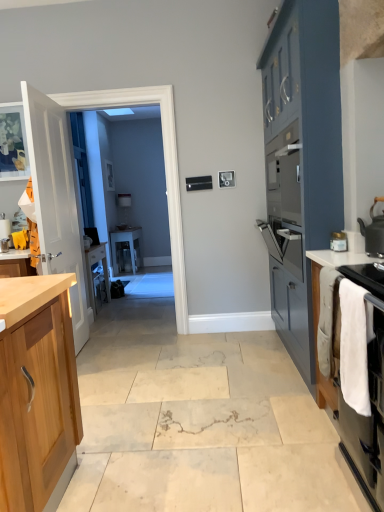
The height and width of the screenshot is (512, 384). Describe the element at coordinates (56, 198) in the screenshot. I see `white wood door at left` at that location.

Describe the element at coordinates (301, 159) in the screenshot. This screenshot has height=512, width=384. I see `matte blue cabinet at right` at that location.

Describe the element at coordinates (339, 258) in the screenshot. I see `white glossy countertop at right` at that location.

What is the approximate width of white fabric towel at right?

white fabric towel at right is 5.94 centimeters wide.

You are a GUI agent. You are given a task and a screenshot of the screen. Output one action in this format:
    pyautogui.click(x=<x>, y=<y>)
    Task: Click on the clear glass table at center
    Image resolution: width=384 pixels, height=512 pixels.
    Given the screenshot: What is the action you would take?
    pyautogui.click(x=126, y=250)

At what (x,y) coordinates should I click in order to perform the action: click on white wood door at left. Please return your answer as a coordinate pair (x, y). This screenshot has width=384, height=512. Looking at the image, I should click on (56, 198).

Find the location of a particular element. This screenshot has width=384, height=512. door in front of the clear glass table at center is located at coordinates click(56, 198).

From a real-world perspective, does clear glass table at center stand above white wood door at left?

No, from a real-world perspective, clear glass table at center is not over white wood door at left

Considering the relative sizes of clear glass table at center and white wood door at left in the image provided, is clear glass table at center bigger than white wood door at left?

Yes, clear glass table at center is bigger than white wood door at left.

From the image's perspective, is clear glass table at center located above white wood door at left?

Actually, clear glass table at center appears below white wood door at left in the image.

From the image's perspective, between matte blue cabinet at right and beige marble floor at center, which one is located above?

matte blue cabinet at right, from the image's perspective.

Do you think matte blue cabinet at right is within beige marble floor at center, or outside of it?

matte blue cabinet at right is located beyond the bounds of beige marble floor at center.

Between matte blue cabinet at right and beige marble floor at center, which one has less height?

With less height is beige marble floor at center.

Can you tell me how much matte blue cabinet at right and beige marble floor at center differ in facing direction?

The angle between the facing direction of matte blue cabinet at right and the facing direction of beige marble floor at center is 91 degrees.

Which point is more forward, (117, 266) or (360, 256)?

The point (360, 256) is closer to the camera.

Considering the relative positions of clear glass table at center and white glossy countertop at right in the image provided, is clear glass table at center to the right of white glossy countertop at right from the viewer's perspective?

No, clear glass table at center is not to the right of white glossy countertop at right.

Between clear glass table at center and white glossy countertop at right, which one has larger width?

clear glass table at center.

Is matte black kettle at upper right oriented away from clear glass table at center?

No, matte black kettle at upper right is not facing away from clear glass table at center.

Is matte black kettle at upper right with clear glass table at center?

No, matte black kettle at upper right is not next to clear glass table at center.

Is clear glass table at center inside matte black kettle at upper right?

No, clear glass table at center is located outside of matte black kettle at upper right.

Based on the photo, considering the positions of objects white wood door at left and clear glass door at center in the image provided, who is more to the left, white wood door at left or clear glass door at center?

white wood door at left.

How different are the orientations of white wood door at left and clear glass door at center in degrees?

They differ by 93 degrees in their facing directions.

Between white wood door at left and clear glass door at center, which one has less height?

With less height is white wood door at left.

From a real-world perspective, is white wood door at left located beneath clear glass door at center?

Yes.

Is beige marble floor at center oriented towards clear glass door at center?

No.

Does beige marble floor at center come in front of clear glass door at center?

Yes, beige marble floor at center is closer to the camera.

What's the angular difference between beige marble floor at center and clear glass door at center's facing directions?

179 degrees.

Would you consider beige marble floor at center to be distant from clear glass door at center?

Absolutely, beige marble floor at center is distant from clear glass door at center.

Is clear glass door at center completely or partially inside clear glass table at center?

No, clear glass door at center is located outside of clear glass table at center.

Is clear glass table at center to the left of clear glass door at center from the viewer's perspective?

Indeed, clear glass table at center is positioned on the left side of clear glass door at center.

From a real-world perspective, relative to clear glass door at center, is clear glass table at center vertically above or below?

From a real-world perspective, clear glass table at center is physically below clear glass door at center.

Is clear glass table at center oriented away from clear glass door at center?

No, clear glass table at center is not facing the opposite direction of clear glass door at center.

Locate an element on the screen. table located behind the white wood door at left is located at coordinates (126, 250).

Locate an element on the screen. concrete below the matte blue cabinet at right (from a real-world perspective) is located at coordinates click(197, 422).

From the image, which object appears to be farther from beige marble floor at center, clear glass table at center or matte black kettle at upper right?

clear glass table at center lies further to beige marble floor at center than the other object.

Which object lies nearer to the anchor point white fabric towel at right, matte black kettle at upper right or clear glass table at center?

matte black kettle at upper right is closer to white fabric towel at right.

Estimate the real-world distances between objects in this image. Which object is further from beige marble floor at center, white wood door at left or white glossy countertop at right?

The object further to beige marble floor at center is white wood door at left.

Which object lies nearer to the anchor point white fabric towel at right, beige marble floor at center or clear glass table at center?

beige marble floor at center.

Considering their positions, is white glossy countertop at right positioned further to matte black kettle at upper right than clear glass door at center?

clear glass door at center is further to matte black kettle at upper right.

From the image, which object appears to be farther from matte black kettle at upper right, white fabric towel at right or matte blue cabinet at right?

matte blue cabinet at right.

Considering their positions, is clear glass door at center positioned closer to white fabric towel at right than white glossy countertop at right?

white glossy countertop at right is closer to white fabric towel at right.

From the image, which object appears to be nearer to matte blue cabinet at right, white glossy countertop at right or white fabric towel at right?

Based on the image, white glossy countertop at right appears to be nearer to matte blue cabinet at right.

Where is `concrete between white fabric towel at right and clear glass door at center along the z-axis`? This screenshot has width=384, height=512. concrete between white fabric towel at right and clear glass door at center along the z-axis is located at coordinates (197, 422).

Locate an element on the screen. Image resolution: width=384 pixels, height=512 pixels. glass door between white wood door at left and matte black kettle at upper right in the horizontal direction is located at coordinates (165, 168).

Identify the location of glass door located between white wood door at left and white glossy countertop at right in the left-right direction. (165, 168).

At what (x,y) coordinates should I click in order to perform the action: click on glass door located between white wood door at left and clear glass table at center in the depth direction. Please return your answer as a coordinate pair (x, y). Looking at the image, I should click on (165, 168).